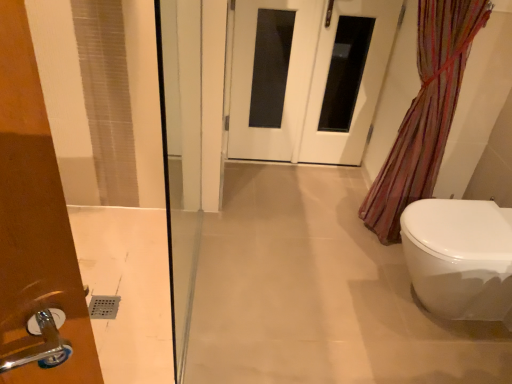
Identify the location of vacant point to the right of white glossy door at center. (293, 181).